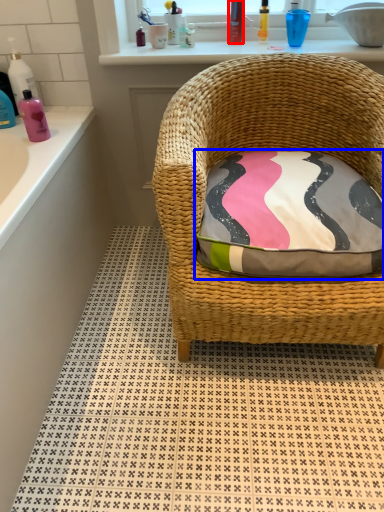
Question: Among these objects, which one is farthest to the camera, toiletry (highlighted by a red box) or pillow (highlighted by a blue box)?

Choices:
 (A) toiletry
 (B) pillow

Answer: (A)